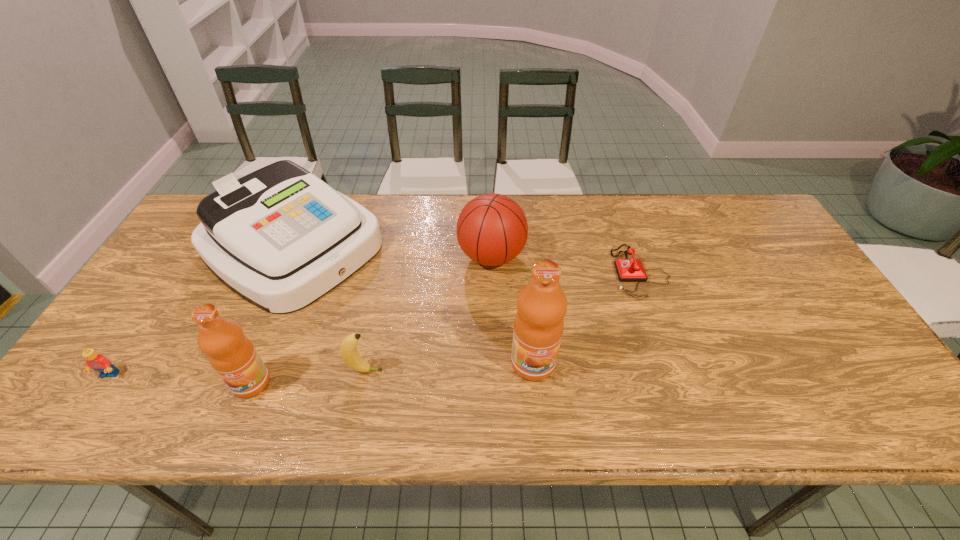
Considering the uniform spacing of fruit juices, where should an additional fruit juice be positioned on the right? Please locate a free spot. Please provide its 2D coordinates. Your answer should be formatted as a tuple, i.e. [(x, y)], where the tuple contains the x and y coordinates of a point satisfying the conditions above.

[(796, 345)]